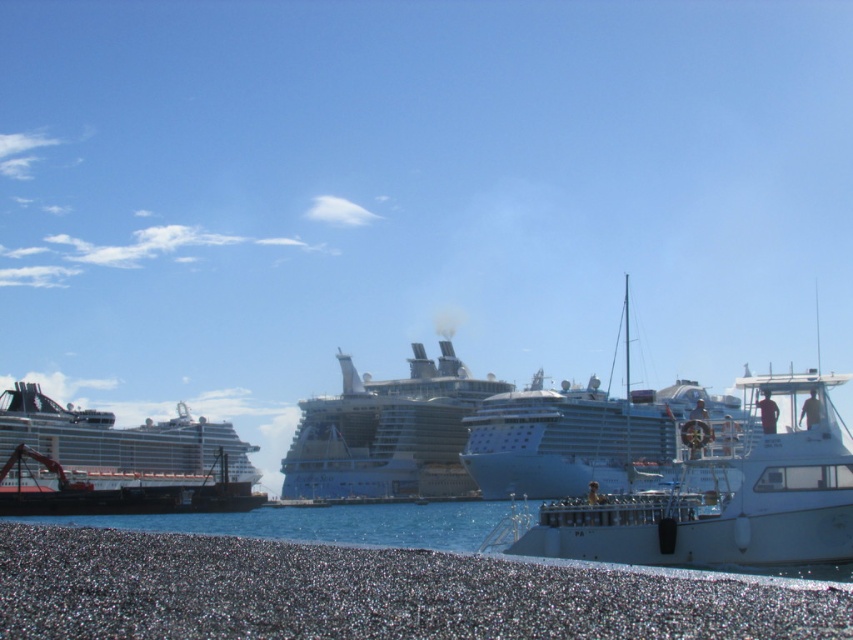
Who is more distant from viewer, (177, 420) or (642, 481)?

The point (177, 420) is behind.

Between point (178, 420) and point (624, 316), which one is positioned in front?

Point (178, 420)

Identify the location of white glossy cruise ship at left. Image resolution: width=853 pixels, height=640 pixels. (115, 461).

Does point (276, 566) come farther from viewer compared to point (361, 378)?

That is False.

Which is more to the right, smooth pebbles at lower left or silver metallic cruise ship at center?

Positioned to the right is smooth pebbles at lower left.

What are the coordinates of `smooth pebbles at lower left` in the screenshot? It's located at coord(370,593).

Is smooth pebbles at lower left taller than white glossy cruise ship at left?

Incorrect, smooth pebbles at lower left's height is not larger of white glossy cruise ship at left's.

Between smooth pebbles at lower left and white glossy cruise ship at left, which one is positioned lower?

Positioned lower is white glossy cruise ship at left.

What are the coordinates of `smooth pebbles at lower left` in the screenshot? It's located at (370, 593).

This screenshot has height=640, width=853. In order to click on smooth pebbles at lower left in this screenshot , I will do `click(370, 593)`.